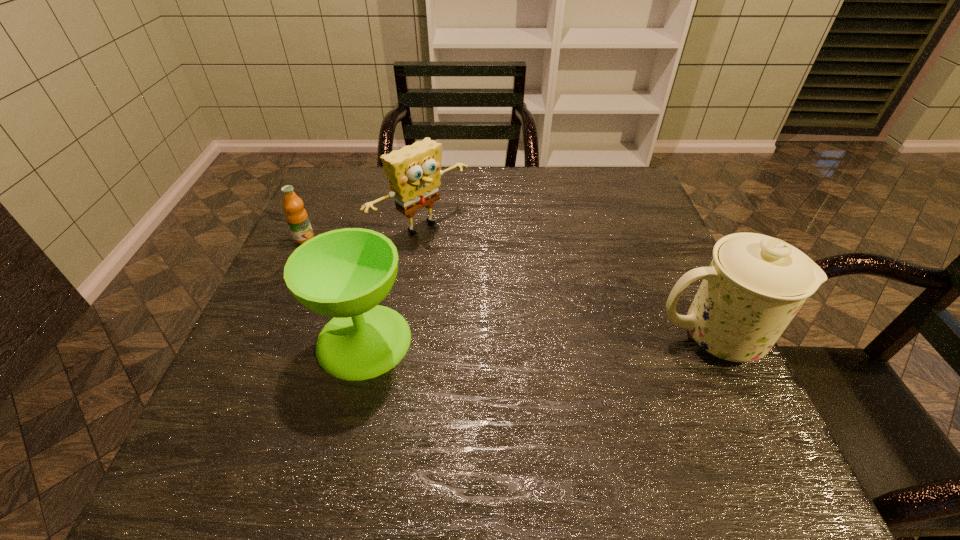
Where is `vacant space located 0.180m on the face of the sponge`? vacant space located 0.180m on the face of the sponge is located at coordinates (502, 286).

Where is `free region located 0.330m on the face of the sponge`? The width and height of the screenshot is (960, 540). free region located 0.330m on the face of the sponge is located at coordinates (551, 322).

Where is `object that is at the far edge`? This screenshot has height=540, width=960. object that is at the far edge is located at coordinates (414, 172).

This screenshot has width=960, height=540. In order to click on wineglass that is at the left edge in this screenshot , I will do `click(345, 273)`.

Identify the location of orange juice that is at the left edge. This screenshot has width=960, height=540. (296, 216).

Identify the location of object at the right edge. The image size is (960, 540). 755,284.

This screenshot has width=960, height=540. I want to click on vacant space at the far edge of the desktop, so pyautogui.click(x=502, y=185).

In the image, there is a desktop. At what (x,y) coordinates should I click in order to perform the action: click on vacant area at the near edge. Please return your answer as a coordinate pair (x, y). Image resolution: width=960 pixels, height=540 pixels. Looking at the image, I should click on (618, 403).

Identify the location of free space at the left edge. This screenshot has width=960, height=540. (259, 328).

Where is `vacant space at the right edge`? vacant space at the right edge is located at coordinates (702, 372).